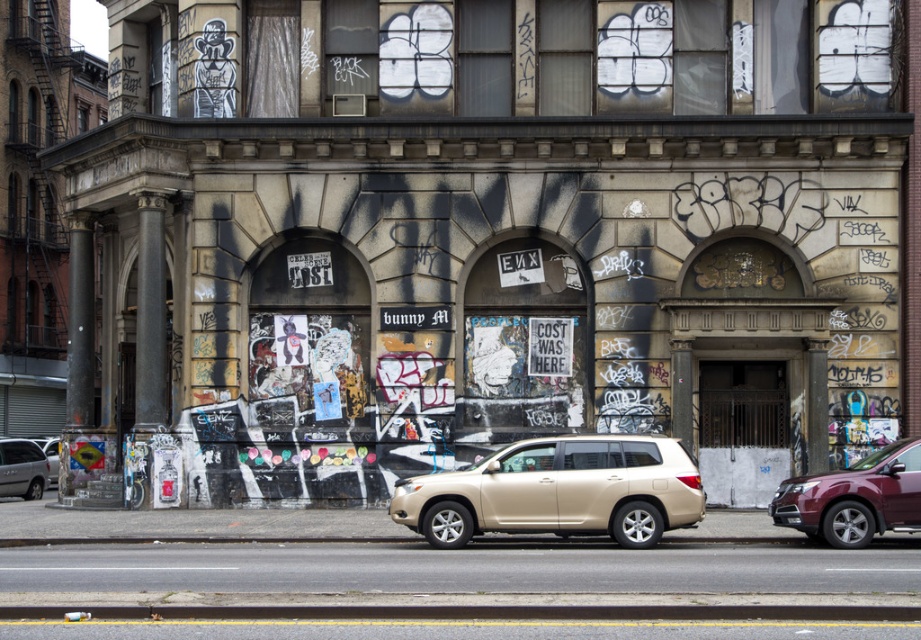
From the picture: You are a delivery driver needing to park your maroon metallic suv at right near the building. The parking spot is at coordinate point 0.778, 0.928. Is your vehicle currently in the correct parking spot?

The maroon metallic suv at right is positioned exactly at point (854,497), so yes, it is correctly parked in the designated spot.

You are a photographer standing in front of the building with two points marked on your camera screen. The first point is at coordinate point (861, 513) and the second is at point (25, 472). Which point is closer to your camera lens?

Point (861, 513) is closer to the camera lens than point (25, 472).